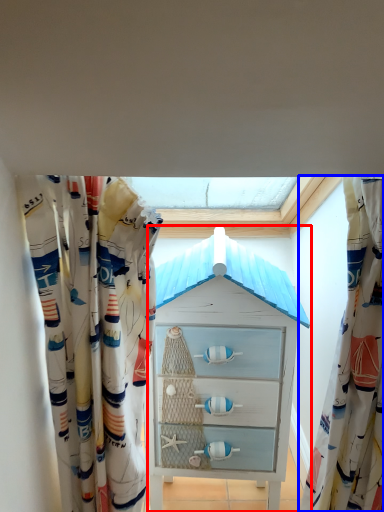
Question: Among these objects, which one is nearest to the camera, chest of drawers (highlighted by a red box) or curtain (highlighted by a blue box)?

Choices:
 (A) chest of drawers
 (B) curtain

Answer: (B)